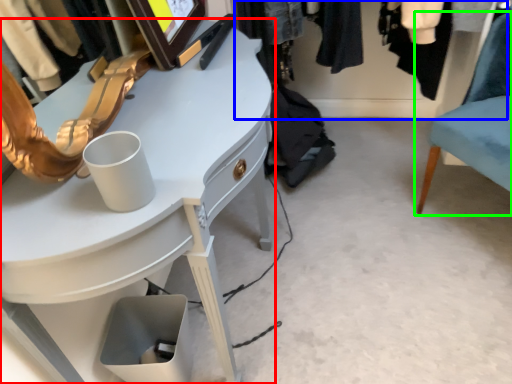
Question: Which object is the farthest from desk (highlighted by a red box)? Choose among these: closet (highlighted by a blue box) or chair (highlighted by a green box).

Choices:
 (A) closet
 (B) chair

Answer: (A)